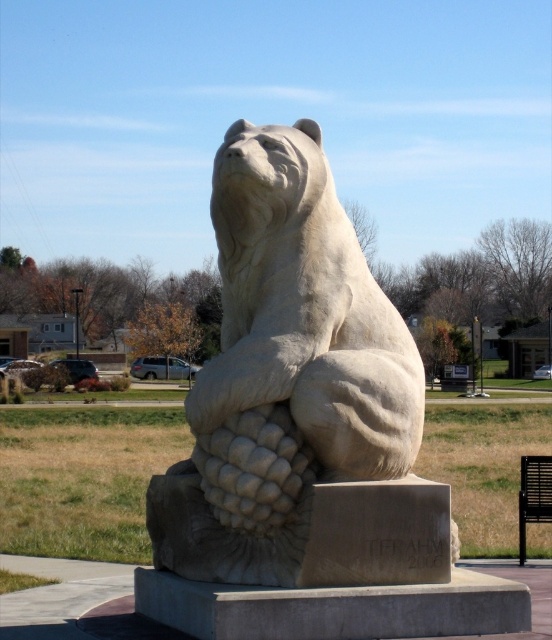
You are a visitor in the park and want to take a photo of the white stone bear at center from the black metal park bench at lower right. Can you see the entire sculpture in your camera frame from that position?

The white stone bear at center is above the black metal park bench at lower right, so yes, you can see the entire sculpture in your camera frame from the bench because the bear is positioned higher and likely within the field of view.

You are a park visitor who wants to take a photo of the white stone bear at center from a distance where you can still see the grapes clearly. The grapes are part of the base. What is the minimum distance you should stand from the bear to ensure the grapes are visible in your photo?

The grapes are part of the base of the white stone bear at center, and they are 8.86 meters apart from the bear. To ensure the grapes are visible in your photo, you should stand at least 8.86 meters away from the bear.

You are standing at the origin point of the park map, which is located at coordinates 0,0. The park map uses a coordinate system where the top right corner is 1,1. Where is the white stone bear at center located on the map?

The white stone bear at center is located at coordinates (299, 396) on the park map.